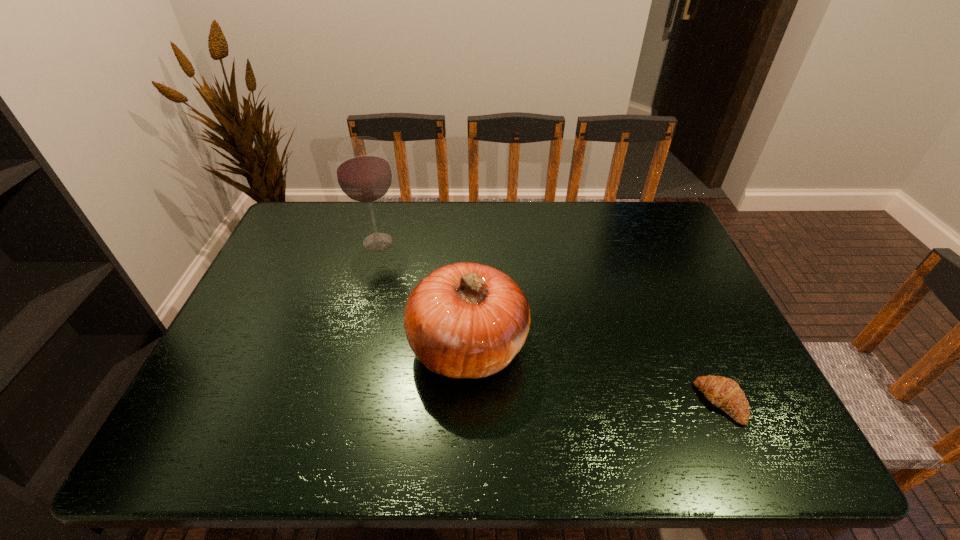
This screenshot has height=540, width=960. Identify the location of object located in the near edge section of the desktop. (724, 393).

The width and height of the screenshot is (960, 540). In order to click on object that is at the right edge in this screenshot , I will do point(724,393).

The image size is (960, 540). What are the coordinates of `object present at the near right corner` in the screenshot? It's located at (724, 393).

At what (x,y) coordinates should I click in order to perform the action: click on vacant area at the far edge of the desktop. Please return your answer as a coordinate pair (x, y). Looking at the image, I should click on (420, 226).

Identify the location of free space at the left edge. (293, 253).

Identify the location of vacant region at the right edge of the desktop. (684, 303).

Identify the location of vacant region at the far left corner. The width and height of the screenshot is (960, 540). (317, 236).

At what (x,y) coordinates should I click in order to perform the action: click on vacant space at the near left corner of the desktop. Please return your answer as a coordinate pair (x, y). The image size is (960, 540). Looking at the image, I should click on (249, 426).

Identify the location of free spot at the far right corner of the desktop. (649, 212).

Where is `vacant space at the near right corner`? The image size is (960, 540). vacant space at the near right corner is located at coordinates (776, 434).